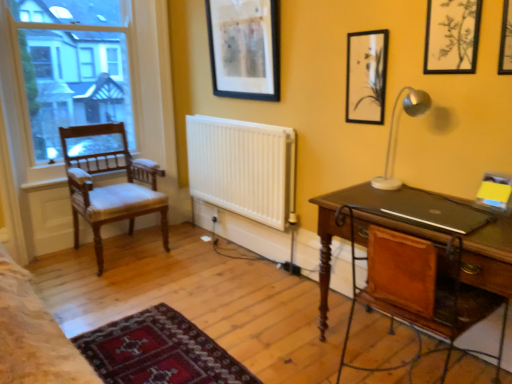
This screenshot has width=512, height=384. What are the coordinates of `free location in front of white matte radiator at center` in the screenshot? It's located at (229, 292).